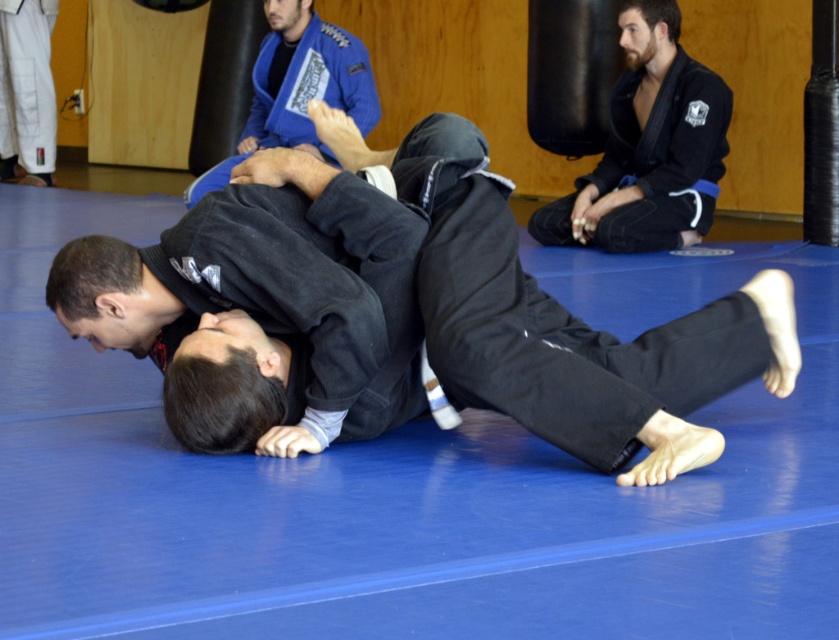
Can you confirm if black matte gi at center is positioned above black matte gi at upper right?

No, black matte gi at center is not above black matte gi at upper right.

In the scene shown: Can you confirm if black matte gi at center is positioned to the left of black matte gi at upper right?

Yes, black matte gi at center is to the left of black matte gi at upper right.

Between point (211, 204) and point (548, 227), which one is positioned behind?

Point (548, 227)

This screenshot has width=839, height=640. Find the location of `black matte gi at center`. black matte gi at center is located at coordinates click(266, 308).

Is black matte gi at center closer to camera compared to blue fabric gi at upper center?

Yes, it is in front of blue fabric gi at upper center.

In the scene shown: Does black matte gi at center appear over blue fabric gi at upper center?

Actually, black matte gi at center is below blue fabric gi at upper center.

Which is in front, point (272, 230) or point (308, 84)?

Point (272, 230) is more forward.

Where is `black matte gi at center`? Image resolution: width=839 pixels, height=640 pixels. black matte gi at center is located at coordinates [266, 308].

Can you confirm if black matte gi at upper right is shorter than blue fabric gi at upper center?

In fact, black matte gi at upper right may be taller than blue fabric gi at upper center.

This screenshot has height=640, width=839. What are the coordinates of `black matte gi at upper right` in the screenshot? It's located at (649, 147).

Does point (608, 202) lie in front of point (295, 36)?

That is True.

Find the location of a particular element. black matte gi at upper right is located at coordinates (649, 147).